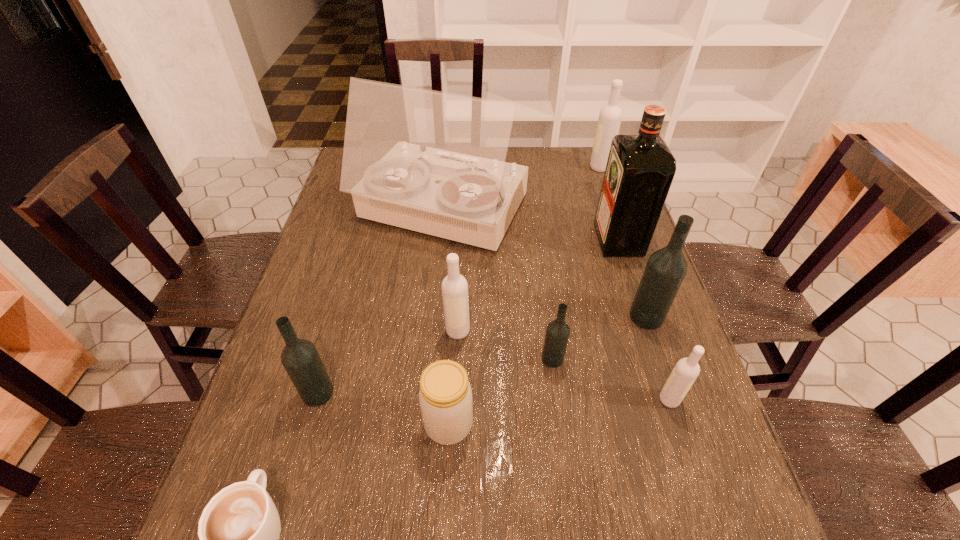
Identify the location of the second farthest black vodka. This screenshot has height=540, width=960. (557, 334).

Locate an element on the screen. This screenshot has height=540, width=960. the second black vodka from left to right is located at coordinates (557, 334).

You are a GUI agent. You are given a task and a screenshot of the screen. Output one action in this format:
    pyautogui.click(x=<x>, y=<y>)
    Task: Click on the smallest white vodka
    
    Given the screenshot: What is the action you would take?
    pyautogui.click(x=685, y=372)

You are a GUI agent. You are given a task and a screenshot of the screen. Output one action in this format:
    pyautogui.click(x=<x>, y=<y>)
    Task: Click on the jar
    This screenshot has height=540, width=960.
    Given the screenshot: What is the action you would take?
    (445, 396)

At what (x,y) coordinates should I click in order to perform the action: click on free location located on the front label of the liquor. Please return your answer as a coordinate pair (x, y). The height and width of the screenshot is (540, 960). Looking at the image, I should click on (475, 239).

Find the location of a particular element. The width and height of the screenshot is (960, 540). vacant space located 0.310m on the front label of the liquor is located at coordinates (490, 239).

Find the location of `blank area located on the front label of the liquor`. blank area located on the front label of the liquor is located at coordinates (486, 239).

At what (x,y) coordinates should I click in order to perform the action: click on free spot located 0.180m on the right of the white record player. Please return your answer as a coordinate pair (x, y). Looking at the image, I should click on (587, 211).

The image size is (960, 540). I want to click on vacant area situated 0.190m on the front of the farthest vodka, so click(x=613, y=207).

I want to click on vacant space located on the front of the farthest black vodka, so click(x=665, y=374).